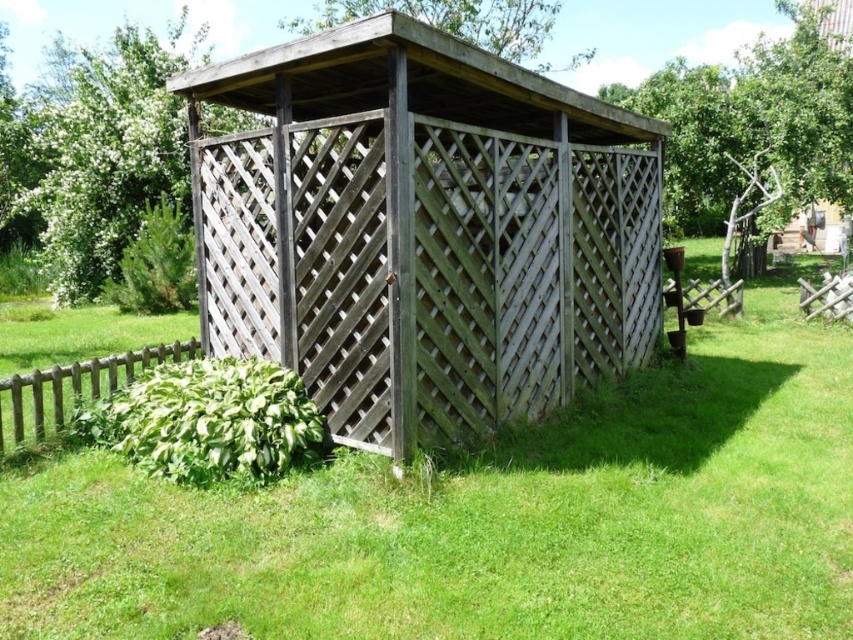
Question: Which of the following is the farthest from the observer?

Choices:
 (A) (125, 365)
 (B) (378, 340)

Answer: (A)

Question: Is green grass at center positioned at the back of brown wooden fence at lower left?

Choices:
 (A) yes
 (B) no

Answer: (B)

Question: Which is farther from the brown wooden fence at lower left?

Choices:
 (A) green grass at center
 (B) weathered wood gazebo at center

Answer: (B)

Question: Which of the following is the farthest from the observer?

Choices:
 (A) weathered wood gazebo at center
 (B) brown wooden fence at lower left
 (C) green grass at center

Answer: (B)

Question: Considering the relative positions of weathered wood gazebo at center and brown wooden fence at lower left in the image provided, where is weathered wood gazebo at center located with respect to brown wooden fence at lower left?

Choices:
 (A) right
 (B) left

Answer: (A)

Question: Can you confirm if green grass at center is positioned to the left of brown wooden fence at lower left?

Choices:
 (A) yes
 (B) no

Answer: (B)